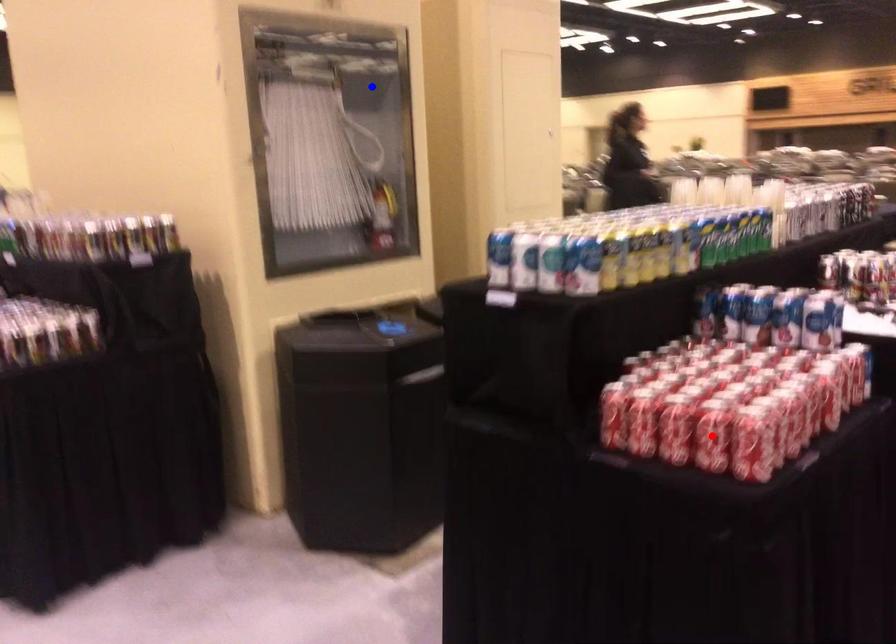
Question: Which of the two points in the image is closer to the camera?

Choices:
 (A) Blue point is closer.
 (B) Red point is closer.

Answer: (B)